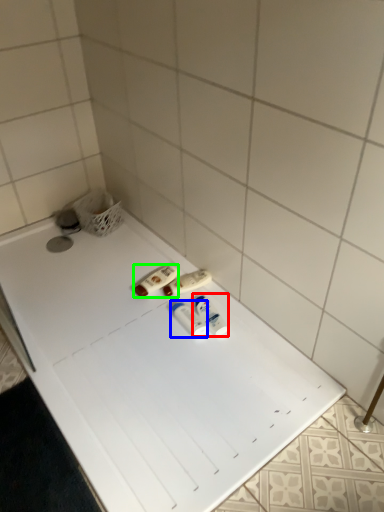
Question: Considering the real-world distances, which object is farthest from toiletry (highlighted by a red box)? toiletry (highlighted by a blue box) or toiletry (highlighted by a green box)?

Choices:
 (A) toiletry
 (B) toiletry

Answer: (B)